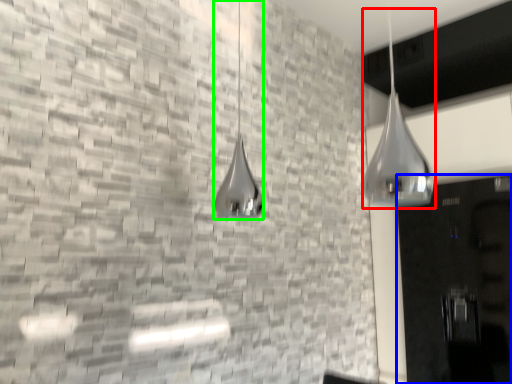
Question: Estimate the real-world distances between objects in this image. Which object is closer to shower (highlighted by a red box), door (highlighted by a blue box) or shower (highlighted by a green box)?

Choices:
 (A) door
 (B) shower

Answer: (A)